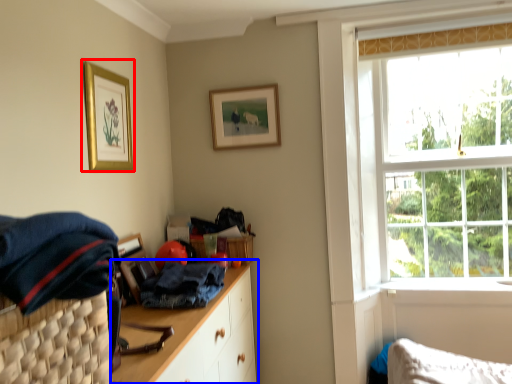
Question: Which object appears farthest to the camera in this image, picture frame (highlighted by a red box) or cabinetry (highlighted by a blue box)?

Choices:
 (A) picture frame
 (B) cabinetry

Answer: (A)